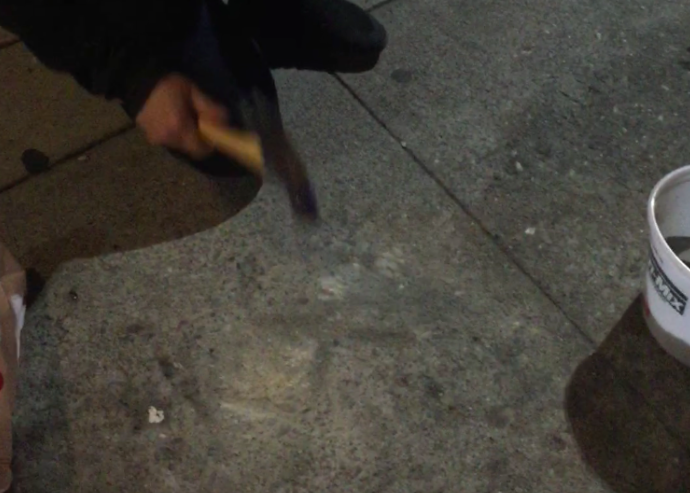
This screenshot has width=690, height=493. Find the location of `white bucket`. white bucket is located at coordinates (x=662, y=317).